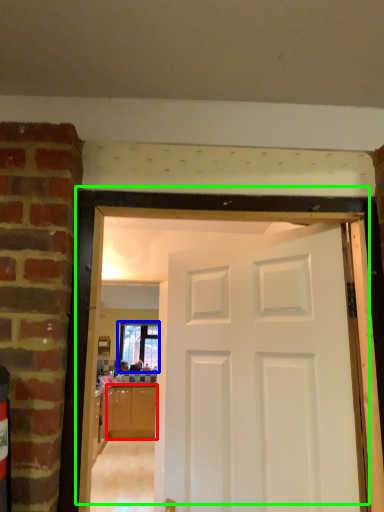
Question: Considering the real-world distances, which object is farthest from cabinetry (highlighted by a red box)? window (highlighted by a blue box) or door (highlighted by a green box)?

Choices:
 (A) window
 (B) door

Answer: (B)